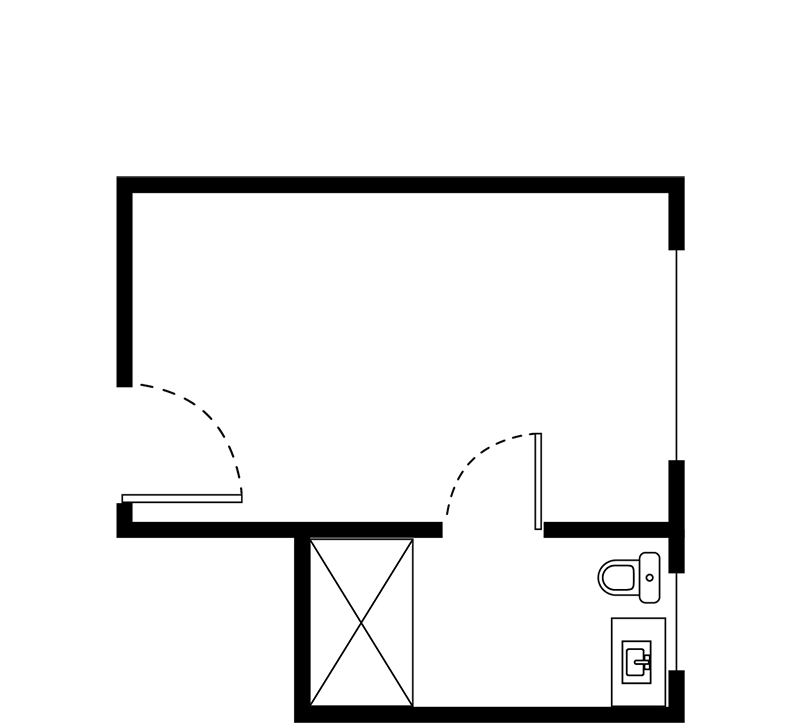
Where is `toilet`? The width and height of the screenshot is (800, 723). toilet is located at coordinates (630, 573).